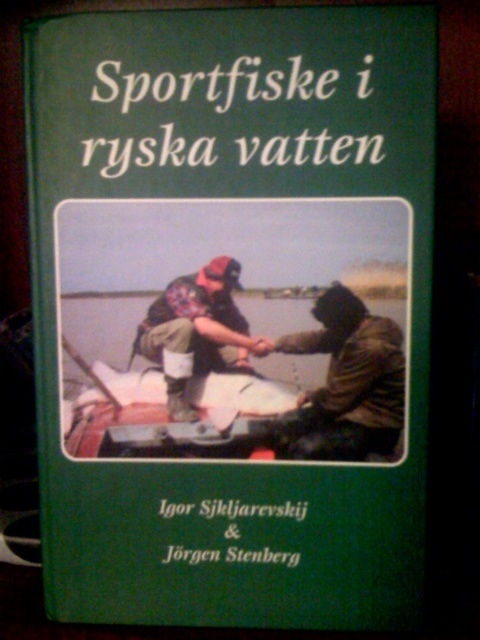
You are looking at the book cover and notice two points marked on it. Which point, point [340,444] or point [195,365], is closer to you?

Point [340,444] is closer to the camera than point [195,365].

You are a photographer standing at a distance and want to capture a closeup shot of the dark green hooded jacket at center featured on the book cover. Considering your current position, can you estimate how far you need to move forward to get a clear closeup without using a zoom lens?

The dark green hooded jacket at center is 19.60 inches away from the viewer. To capture a closeup without a zoom lens, you would need to move approximately 19.60 inches closer to the jacket.